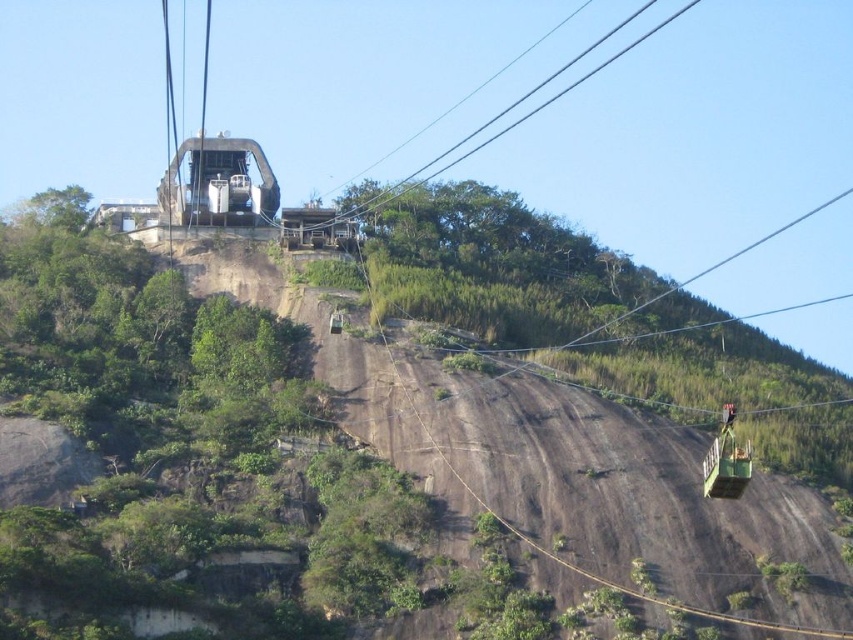
Question: Where is green metallic cable car at right located in relation to metallic gray cable car at upper center in the image?

Choices:
 (A) right
 (B) left

Answer: (A)

Question: Does green metallic cable car at right appear on the left side of metallic gray cable car at upper center?

Choices:
 (A) yes
 (B) no

Answer: (B)

Question: Among these points, which one is farthest from the camera?

Choices:
 (A) (215, 179)
 (B) (730, 458)

Answer: (A)

Question: Which of the following is the farthest from the observer?

Choices:
 (A) (212, 189)
 (B) (734, 467)

Answer: (A)

Question: Can you confirm if green metallic cable car at right is positioned above metallic gray cable car at upper center?

Choices:
 (A) yes
 (B) no

Answer: (B)

Question: Which point is farther from the camera taking this photo?

Choices:
 (A) (225, 192)
 (B) (735, 468)

Answer: (A)